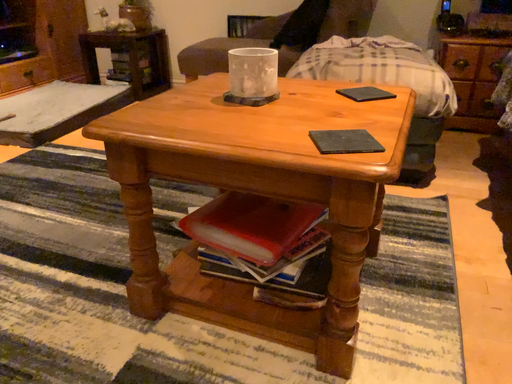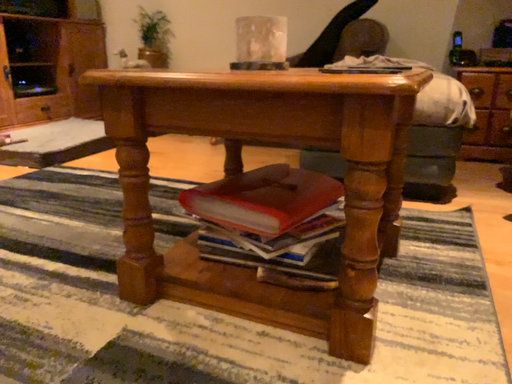
Question: Which way did the camera rotate in the video?

Choices:
 (A) rotated downward
 (B) rotated upward

Answer: (B)